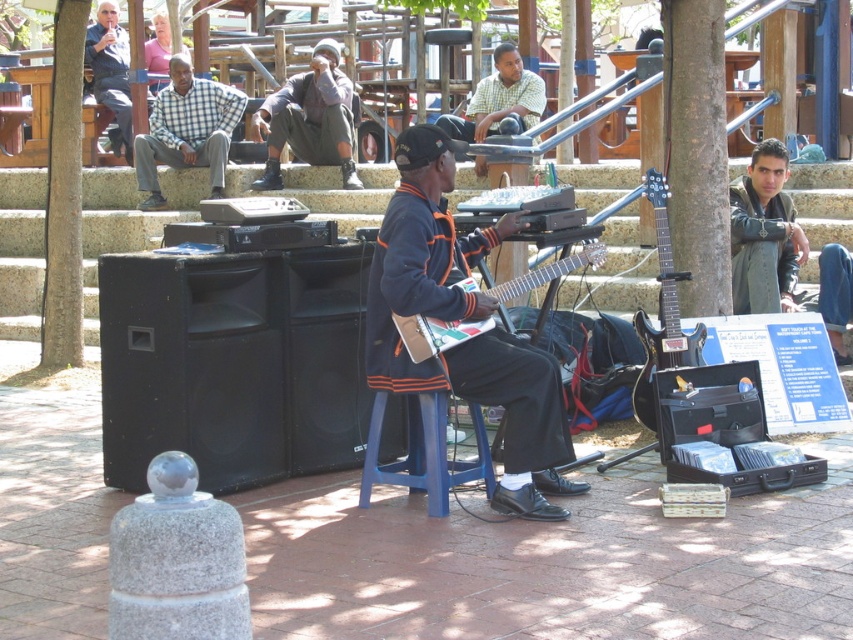
Question: Which point is closer to the camera?

Choices:
 (A) dark blue uniform at center
 (B) matte black jacket at upper left
 (C) black glossy electric guitar at center

Answer: (C)

Question: Which point is farther to the camera?

Choices:
 (A) (735, 243)
 (B) (114, 54)

Answer: (B)

Question: Among these points, which one is farthest from the camera?

Choices:
 (A) (740, 220)
 (B) (190, 113)
 (C) (503, 113)

Answer: (B)

Question: Observing the image, what is the correct spatial positioning of orange fabric jacket at center in reference to dark brown leather jacket at upper right?

Choices:
 (A) right
 (B) left

Answer: (B)

Question: Does orange fabric jacket at center have a lesser width compared to matte black jacket at upper left?

Choices:
 (A) no
 (B) yes

Answer: (A)

Question: Can you confirm if black glossy electric guitar at center is smaller than matte black guitar at center?

Choices:
 (A) no
 (B) yes

Answer: (A)